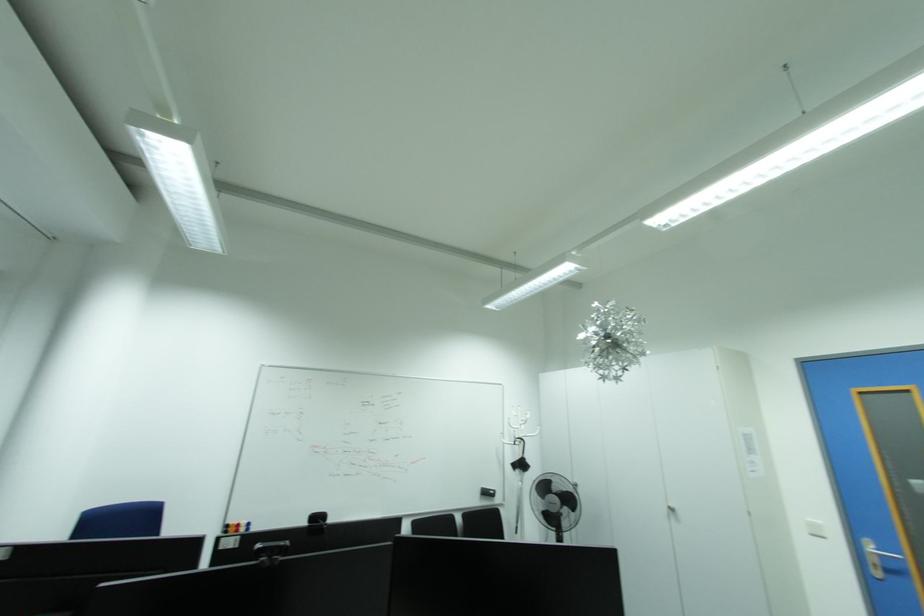
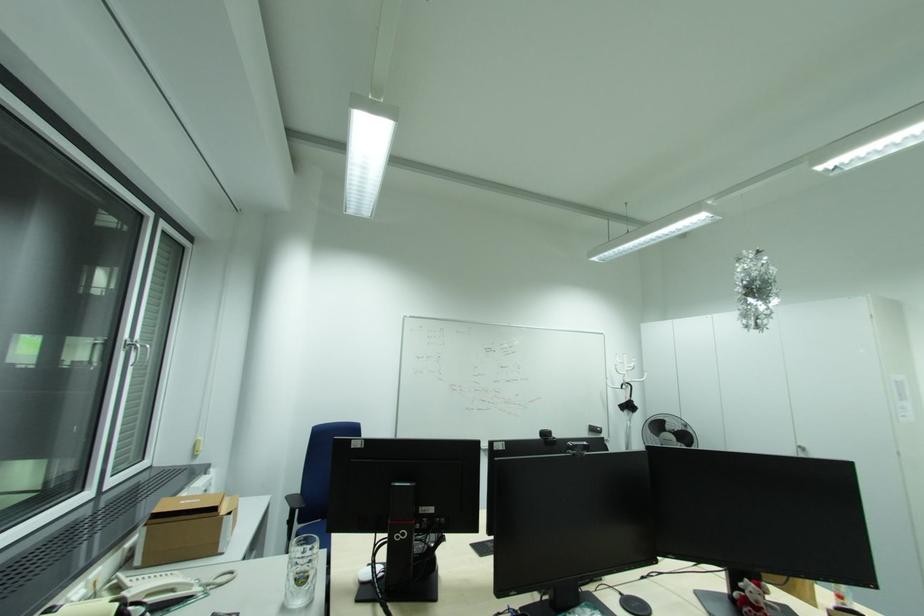
In a continuous first-person perspective shot, in which direction is the camera moving?

The movement direction of the cameraman is left, backward.